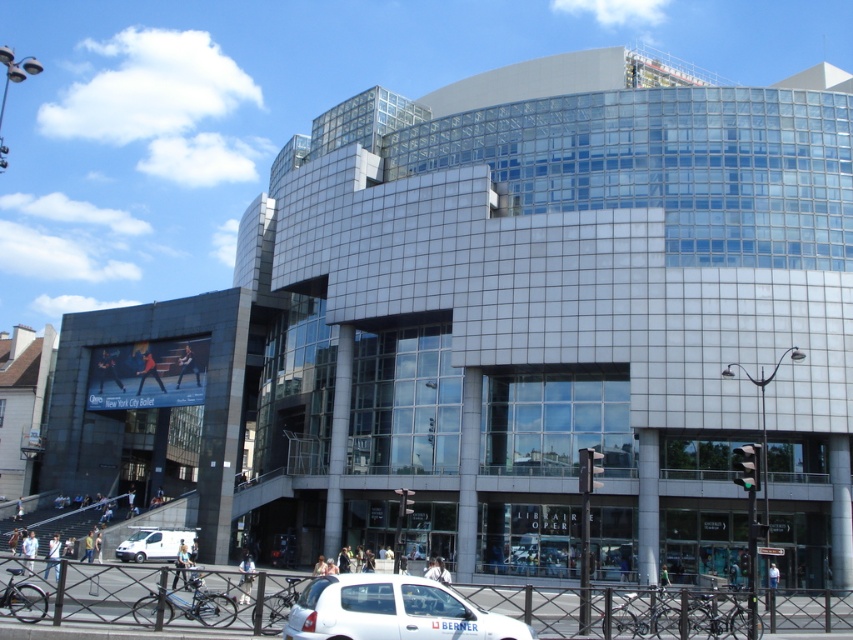
Describe the element at coordinates (392, 611) in the screenshot. I see `white matte car at lower center` at that location.

From the picture: Can you confirm if white matte car at lower center is positioned above white matte van at lower left?

Correct, white matte car at lower center is located above white matte van at lower left.

Who is more forward, (314, 620) or (155, 531)?

Point (314, 620) is more forward.

Where is `white matte car at lower center`? Image resolution: width=853 pixels, height=640 pixels. white matte car at lower center is located at coordinates (392, 611).